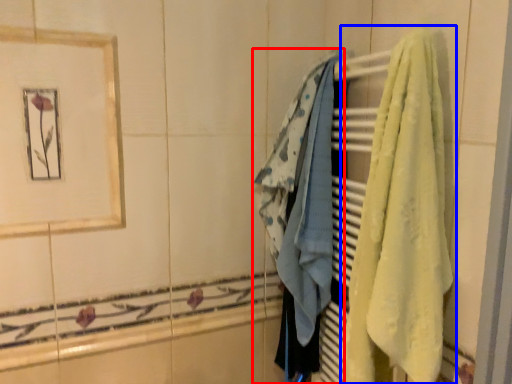
Question: Which object appears farthest to the camera in this image, towel (highlighted by a red box) or towel (highlighted by a blue box)?

Choices:
 (A) towel
 (B) towel

Answer: (A)